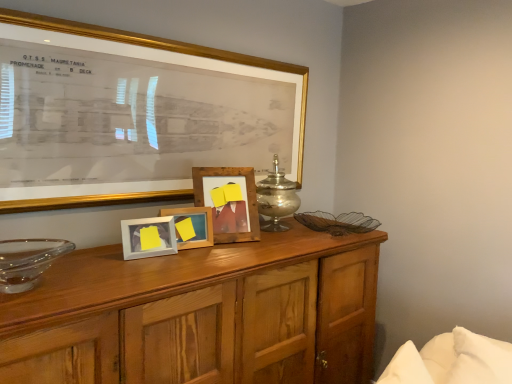
At what (x,y) coordinates should I click in order to perform the action: click on blank area beneath transparent glass bowl at left (from a real-world perspective). Please return your answer as a coordinate pair (x, y). Image resolution: width=512 pixels, height=384 pixels. Looking at the image, I should click on (33, 277).